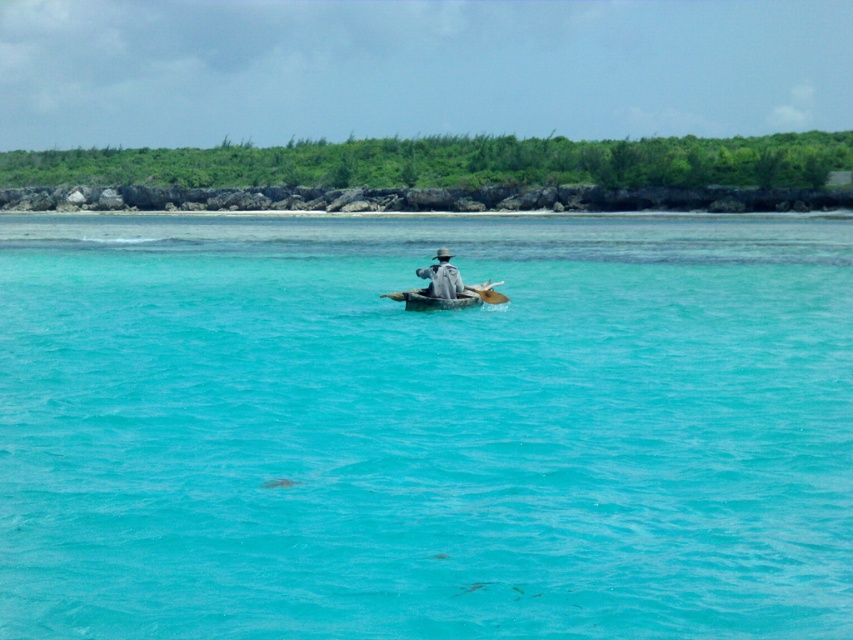
You are a photographer trying to capture the reflection of the gray fabric hat at center and the wooden paddle at center in the water. Which object will have a clearer reflection?

The wooden paddle at center will have a clearer reflection because it is lower than the gray fabric hat at center, and reflections are clearer for objects closer to the water surface.

You are standing at the edge of the water in the coastal scene. There are two points marked on the image, point 1 at coordinates point (x=785, y=452) and point 2 at coordinates point (x=456, y=294). Which point is closer to you?

Point (x=785, y=452) is closer to the camera than point (x=456, y=294), so the point closer to you is point (x=785, y=452).